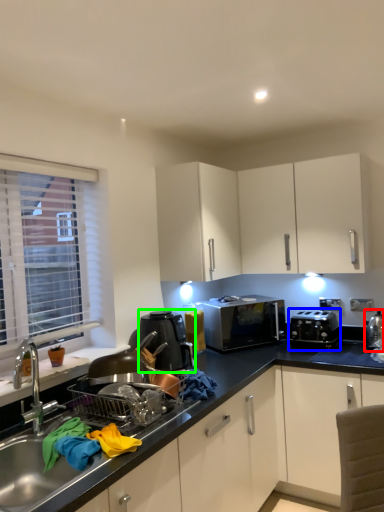
Question: Estimate the real-world distances between objects in this image. Which object is closer to appliance (highlighted by a red box), appliance (highlighted by a blue box) or kitchen appliance (highlighted by a green box)?

Choices:
 (A) appliance
 (B) kitchen appliance

Answer: (A)